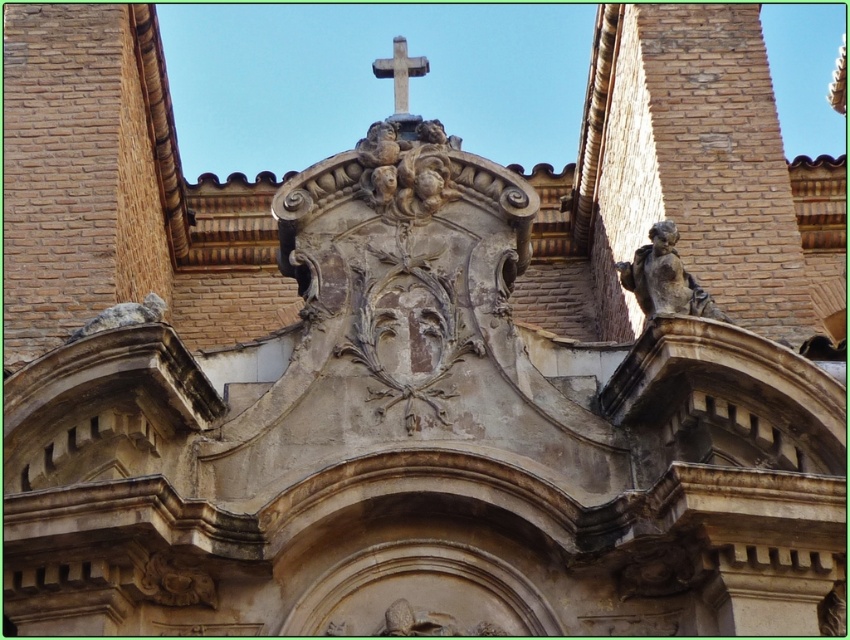
You are an art student analyzing the architectural details of a cathedral. You notice the stone statue at right and the white stone cross at upper center. From the perspective of someone standing directly in front of the structure, which object is positioned to the right of the other?

The stone statue at right is to the right of the white stone cross at upper center.

You are an art student analyzing the architectural details of a cathedral. You observe the stone statue at right and the white stone cross at upper center. Which object is larger in size?

The white stone cross at upper center is larger than the stone statue at right.